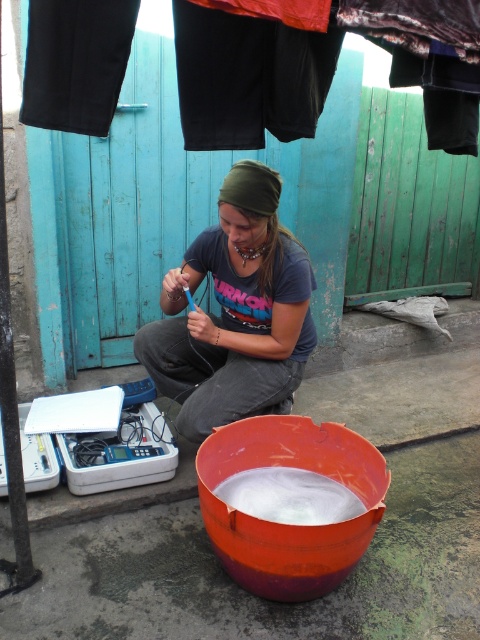
Which is more to the left, orange plastic bucket at lower center or white frothy substance at lower center?

white frothy substance at lower center

Does point (456, 438) come behind point (290, 499)?

That is True.

The width and height of the screenshot is (480, 640). In order to click on orange plastic bucket at lower center in this screenshot , I will do `click(255, 596)`.

Does orange plastic bucket at lower center have a larger size compared to matte orange bowl at center?

Correct, orange plastic bucket at lower center is larger in size than matte orange bowl at center.

Is point (357, 586) positioned in front of point (276, 556)?

No, it is not.

At what (x,y) coordinates should I click in order to perform the action: click on orange plastic bucket at lower center. Please return your answer as a coordinate pair (x, y). The width and height of the screenshot is (480, 640). Looking at the image, I should click on (255, 596).

Is matte gray shirt at center to the right of matte orange bowl at center from the viewer's perspective?

Incorrect, matte gray shirt at center is not on the right side of matte orange bowl at center.

Between point (158, 356) and point (292, 595), which one is positioned behind?

Positioned behind is point (158, 356).

Where is `matte gray shirt at center`? The image size is (480, 640). matte gray shirt at center is located at coordinates (235, 312).